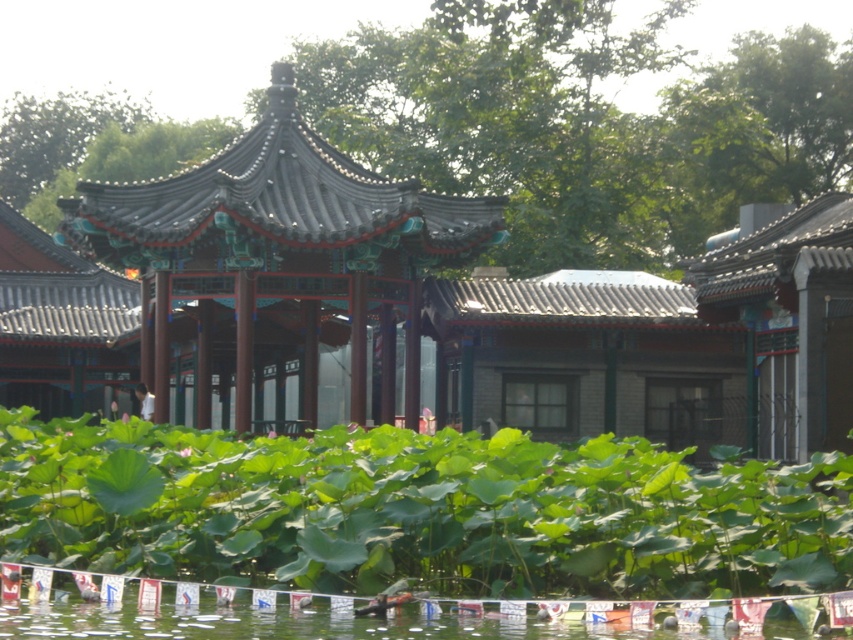
You are a visitor standing in the garden and want to take a photo of the shiny dark gray gazebo at center. However, there are green leafy plants at center blocking your view. Can you still see the gazebo clearly?

The green leafy plants at center are in front of the shiny dark gray gazebo at center, so they block the view of the gazebo. You cannot see the gazebo clearly.